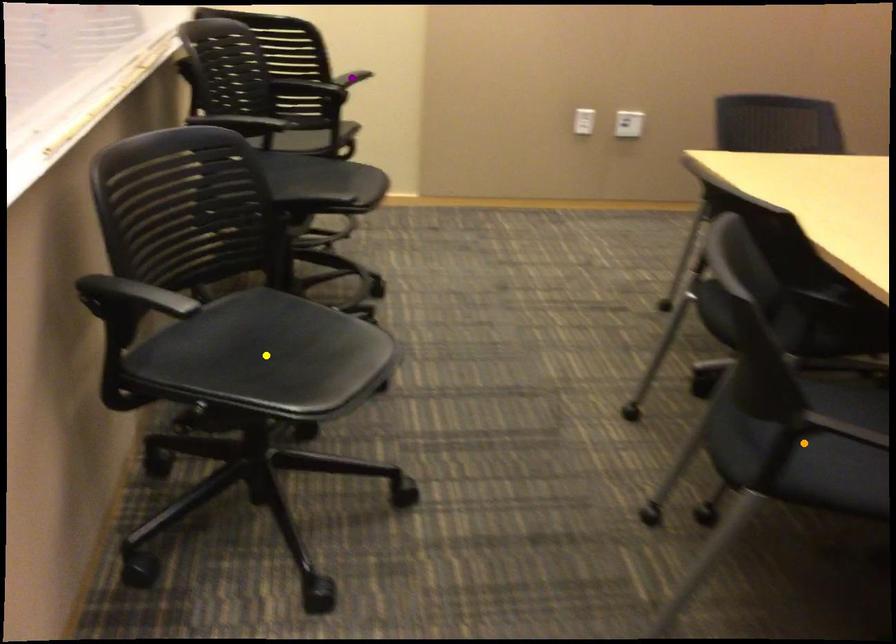
Order these from nearest to farthest:
- purple point
- yellow point
- orange point

orange point < yellow point < purple point